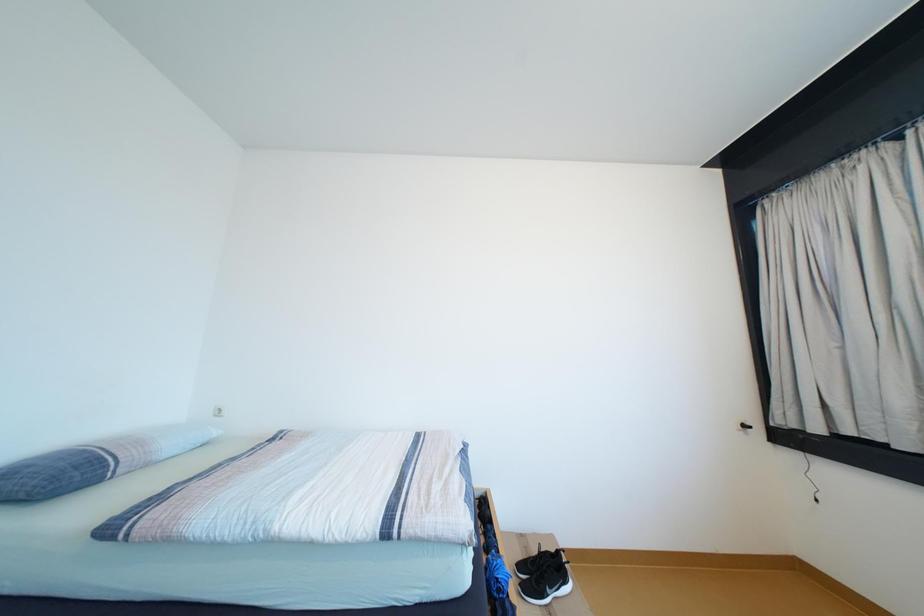
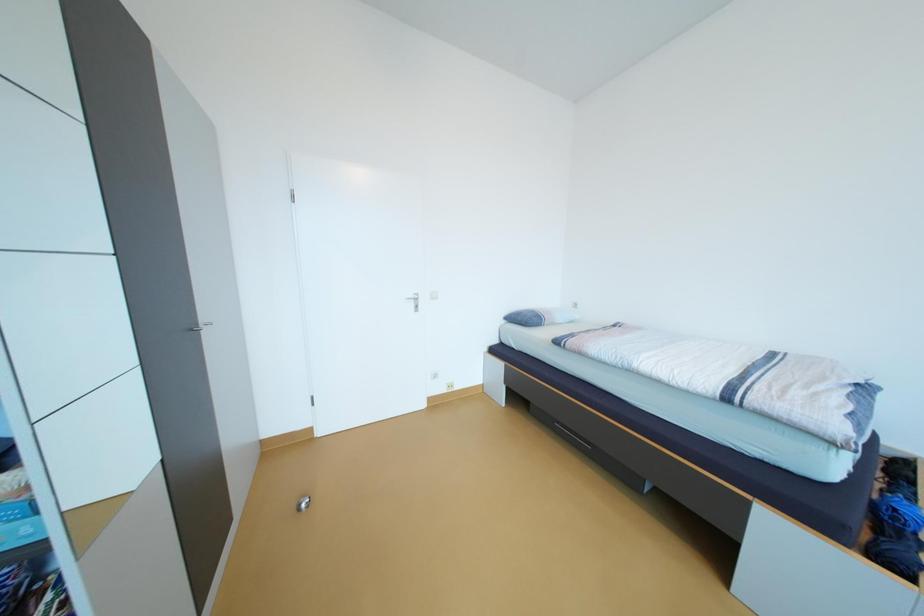
Question: How did the camera likely rotate?

Choices:
 (A) Left
 (B) Right
 (C) Up
 (D) Down

Answer: (A)